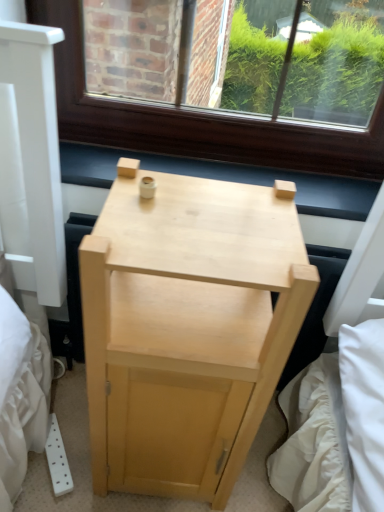
Question: Is natural wood nightstand at center facing towards light wood at center?

Choices:
 (A) no
 (B) yes

Answer: (A)

Question: Considering the relative positions of natural wood nightstand at center and light wood at center in the image provided, is natural wood nightstand at center to the left of light wood at center from the viewer's perspective?

Choices:
 (A) no
 (B) yes

Answer: (B)

Question: Would you say natural wood nightstand at center contains light wood at center?

Choices:
 (A) yes
 (B) no

Answer: (B)

Question: Considering the relative sizes of natural wood nightstand at center and light wood at center in the image provided, is natural wood nightstand at center smaller than light wood at center?

Choices:
 (A) yes
 (B) no

Answer: (B)

Question: From the image's perspective, is natural wood nightstand at center above light wood at center?

Choices:
 (A) yes
 (B) no

Answer: (B)

Question: From a real-world perspective, is natural wood nightstand at center on top of light wood at center?

Choices:
 (A) no
 (B) yes

Answer: (A)

Question: Is light wood at center looking in the opposite direction of natural wood nightstand at center?

Choices:
 (A) yes
 (B) no

Answer: (B)

Question: From a real-world perspective, is light wood at center beneath natural wood nightstand at center?

Choices:
 (A) no
 (B) yes

Answer: (A)

Question: Does light wood at center have a smaller size compared to natural wood nightstand at center?

Choices:
 (A) yes
 (B) no

Answer: (A)

Question: Is light wood at center to the right of natural wood nightstand at center from the viewer's perspective?

Choices:
 (A) yes
 (B) no

Answer: (A)

Question: Is light wood at center taller than natural wood nightstand at center?

Choices:
 (A) yes
 (B) no

Answer: (B)

Question: Would you say natural wood nightstand at center is part of light wood at center's contents?

Choices:
 (A) no
 (B) yes

Answer: (A)

Question: Would you say natural wood nightstand at center is to the left or to the right of light wood at center in the picture?

Choices:
 (A) left
 (B) right

Answer: (A)